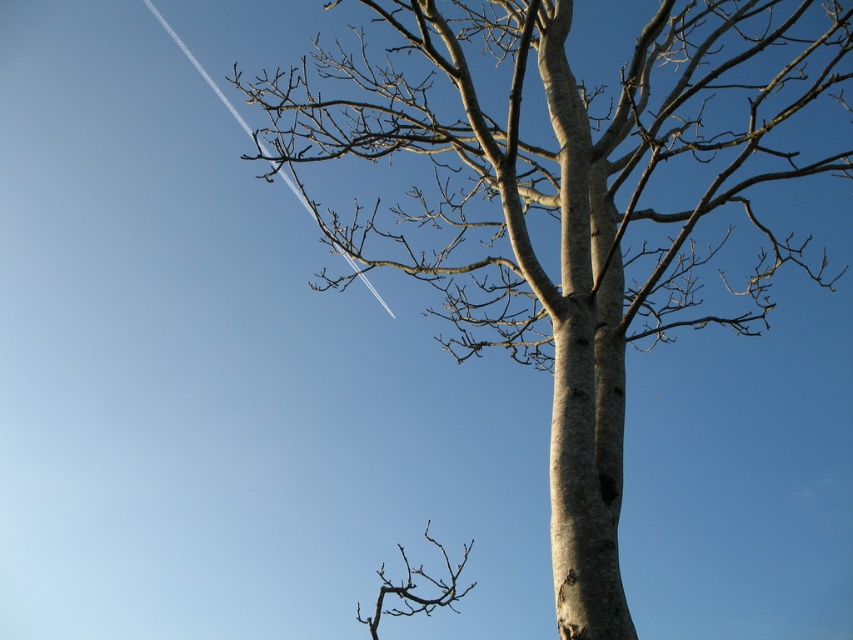
You are an artist sketching the scene and need to place the smooth bark tree at center and the brown rough branch at lower center accurately. Based on their positions, which object should you draw first to ensure proper alignment?

The brown rough branch at lower center should be drawn first because the smooth bark tree at center is positioned on its right side, meaning the branch is closer to the viewer and forms the base for the tree.

You are an artist sketching the scene. You need to determine the relative height of the smooth bark tree at center and the brown rough branch at lower center to ensure proper proportions. Which one is taller?

The smooth bark tree at center is taller than the brown rough branch at lower center according to the description.

You are a bird looking for a place to land. The smooth bark tree at center has a branch that is 5.71 feet away from the brown rough branch at lower center. Which branch should you choose to land on if you prefer a smoother surface?

The smooth bark tree at center has smoother bark compared to the brown rough branch at lower center, so you should choose to land on the smooth bark tree at center.